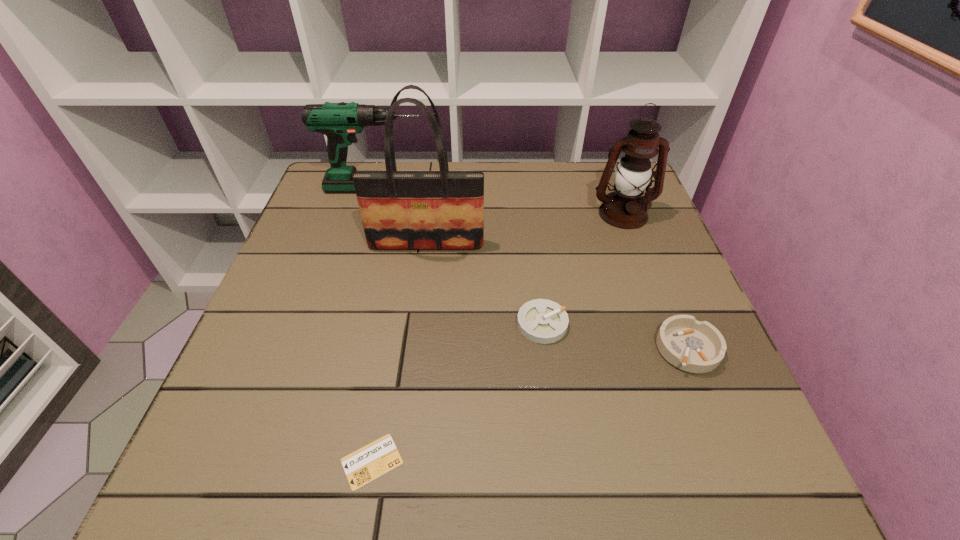
Find the location of `identity card`. identity card is located at coordinates (370, 462).

You are a GUI agent. You are given a task and a screenshot of the screen. Output one action in this format:
    pyautogui.click(x=<x>, y=<y>)
    Task: Click on the shortest object
    The height and width of the screenshot is (540, 960).
    Given the screenshot: What is the action you would take?
    pyautogui.click(x=370, y=462)

This screenshot has height=540, width=960. I want to click on free location located 0.390m on the front-facing side of the shopping bag, so click(404, 410).

In order to click on vacant space located 0.110m on the side of the second tallest object, there is a wick adjustment knob in this screenshot , I will do `click(640, 260)`.

Where is `vacant region located on the handle side of the third tallest object`? The width and height of the screenshot is (960, 540). vacant region located on the handle side of the third tallest object is located at coordinates (540, 188).

What are the coordinates of `free space located on the left of the right ashtray` in the screenshot? It's located at (610, 348).

Locate an element on the screen. The height and width of the screenshot is (540, 960). vacant space located 0.220m on the right of the second shortest object is located at coordinates (678, 323).

Where is `free space located on the back of the shortest object`? free space located on the back of the shortest object is located at coordinates (396, 327).

At what (x,y) coordinates should I click in order to perform the action: click on lantern present at the far edge. Please return your answer as a coordinate pair (x, y). This screenshot has height=540, width=960. Looking at the image, I should click on (625, 208).

Find the location of `drill that is at the far edge`. drill that is at the far edge is located at coordinates (340, 122).